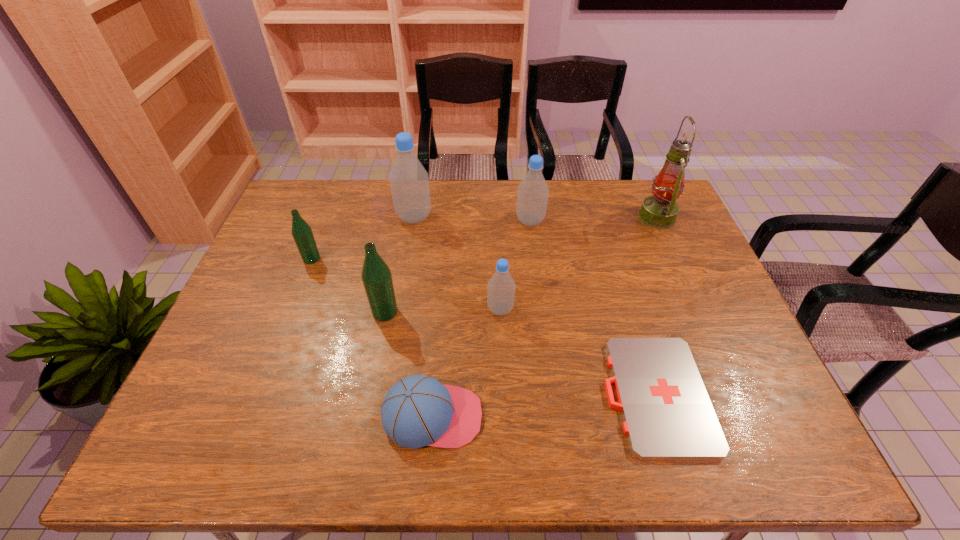
Locate an element on the screen. green oil lamp is located at coordinates (660, 210).

The width and height of the screenshot is (960, 540). In order to click on the rightmost object in this screenshot , I will do `click(660, 210)`.

Identify the location of the biggest gray bottle. Image resolution: width=960 pixels, height=540 pixels. (409, 182).

This screenshot has width=960, height=540. I want to click on the tallest bottle, so click(x=409, y=182).

At what (x,y) coordinates should I click in order to perform the action: click on the rightmost bottle. Please return your answer as a coordinate pair (x, y). Looking at the image, I should click on (532, 195).

Where is `the second biggest gray bottle`? The image size is (960, 540). the second biggest gray bottle is located at coordinates (532, 195).

I want to click on the bigger green bottle, so click(376, 276).

This screenshot has height=540, width=960. I want to click on the right green bottle, so click(376, 276).

The image size is (960, 540). I want to click on the fourth object from right to left, so click(501, 287).

Identify the location of the second gray bottle from left to right. Image resolution: width=960 pixels, height=540 pixels. (501, 287).